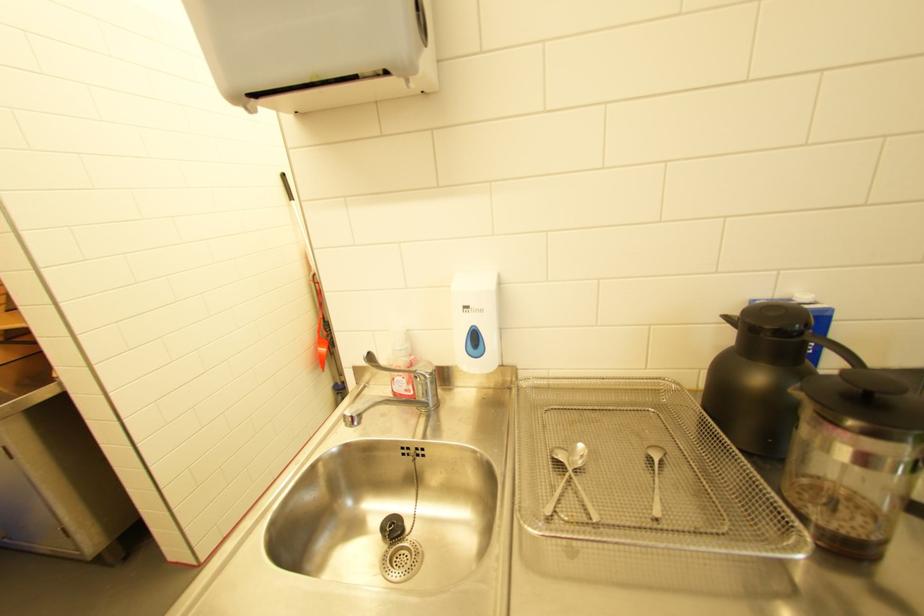
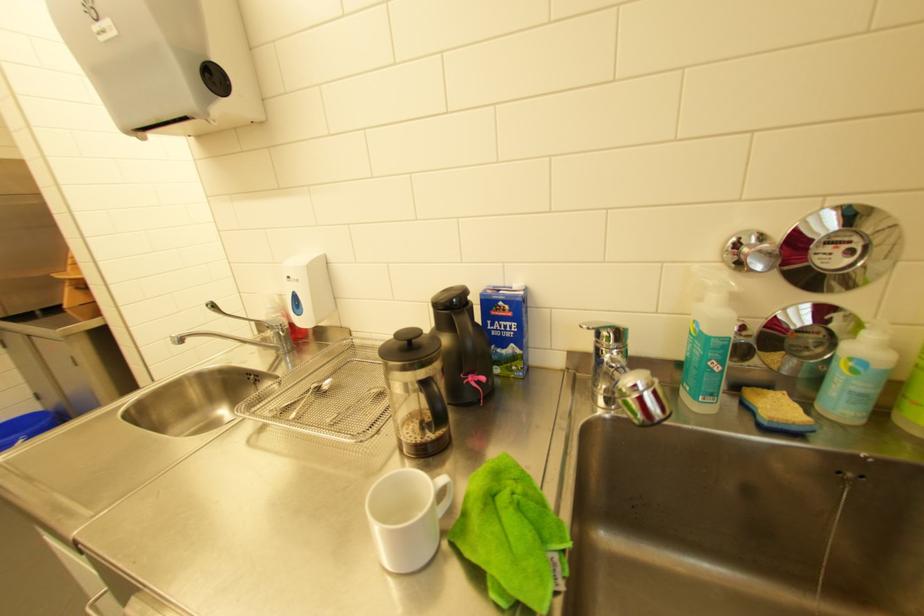
Question: Based on the continuous images, in which direction is the camera rotating? Reply with the corresponding letter.

Choices:
 (A) Left
 (B) Right
 (C) Up
 (D) Down

Answer: (A)